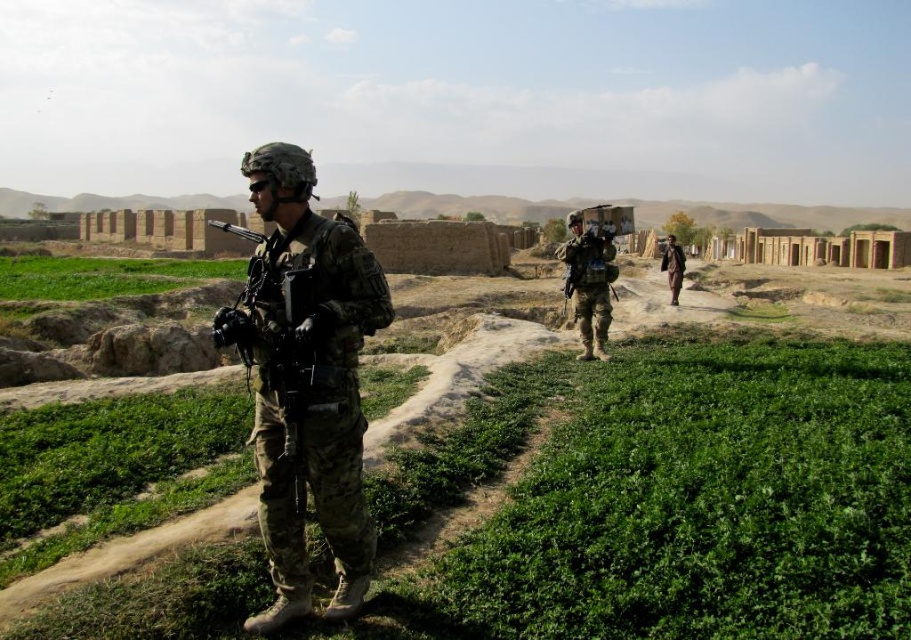
Question: Is camouflage uniform at center bigger than matte black helmet at upper center?

Choices:
 (A) yes
 (B) no

Answer: (A)

Question: Which of the following is the farthest from the observer?

Choices:
 (A) (681, 257)
 (B) (590, 349)

Answer: (A)

Question: Which is farther from the brown fabric jacket at center-right?

Choices:
 (A) matte black helmet at upper center
 (B) camouflage uniform at center

Answer: (B)

Question: Which of these objects is positioned farthest from the brown fabric jacket at center-right?

Choices:
 (A) camouflage uniform at center
 (B) matte black helmet at upper center

Answer: (A)

Question: Observing the image, what is the correct spatial positioning of camouflage uniform at center in reference to matte black helmet at upper center?

Choices:
 (A) above
 (B) below

Answer: (B)

Question: Observing the image, what is the correct spatial positioning of camouflage uniform at center in reference to brown fabric jacket at center-right?

Choices:
 (A) right
 (B) left

Answer: (B)